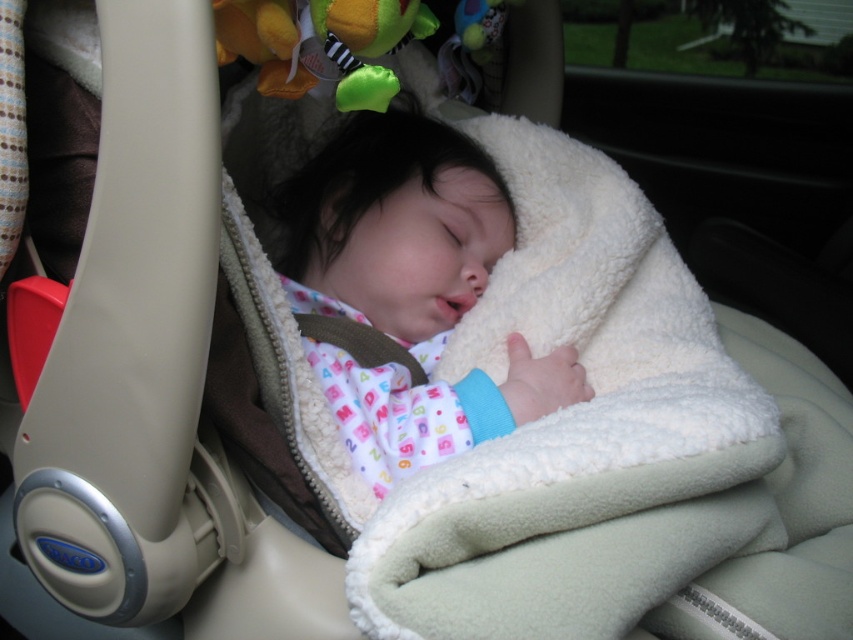
You are a parent checking on your baby in the car seat. You want to ensure the white fleece blanket at center is close enough to the baby without being too tight. Based on the distance provided, is the blanket positioned at a safe distance?

The white fleece blanket at center is positioned at a safe distance of 17.74 inches from the viewer, which allows the baby to breathe comfortably while remaining securely swaddled.

You are a parent trying to place a soft plush frog at upper center onto the white fleece blanket at center in the car seat. Can you safely place the frog on the blanket without it falling off?

The distance between the white fleece blanket at center and the soft plush frog at upper center is 12.72 inches. Since the frog is placed above the blanket, it won,t fall off as long as it is positioned securely on the blanket.